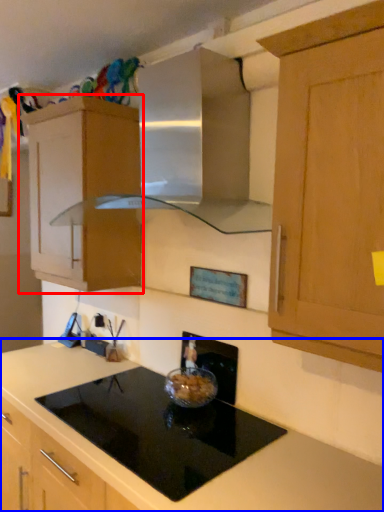
Question: Which of the following is the closest to the observer, cabinetry (highlighted by a red box) or countertop (highlighted by a blue box)?

Choices:
 (A) cabinetry
 (B) countertop

Answer: (B)